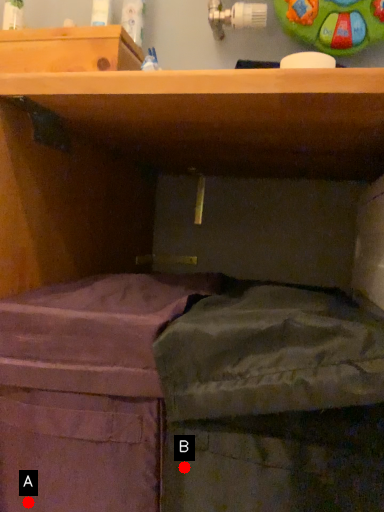
Question: Two points are circled on the image, labeled by A and B beside each circle. Which point is farther to the camera?

Choices:
 (A) A is further
 (B) B is further

Answer: (A)